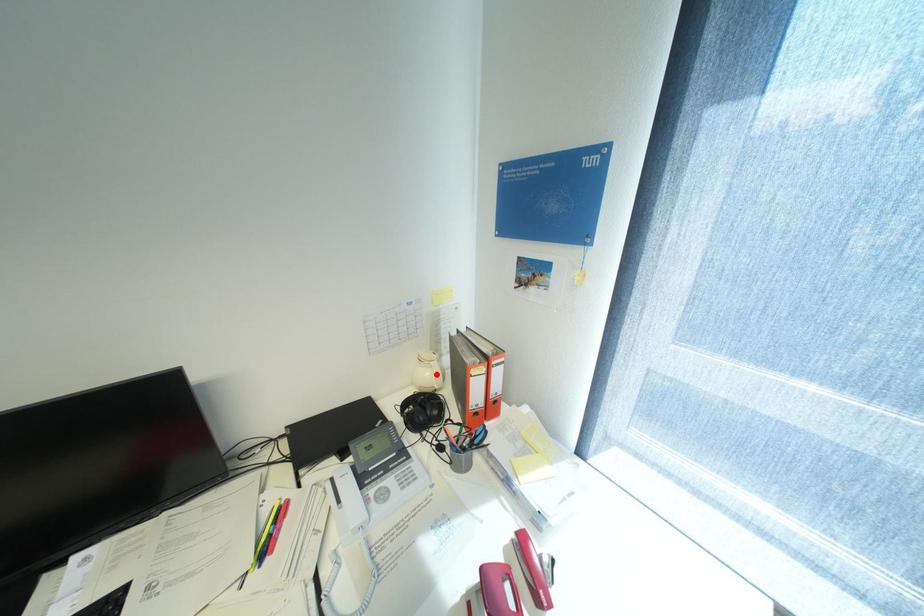
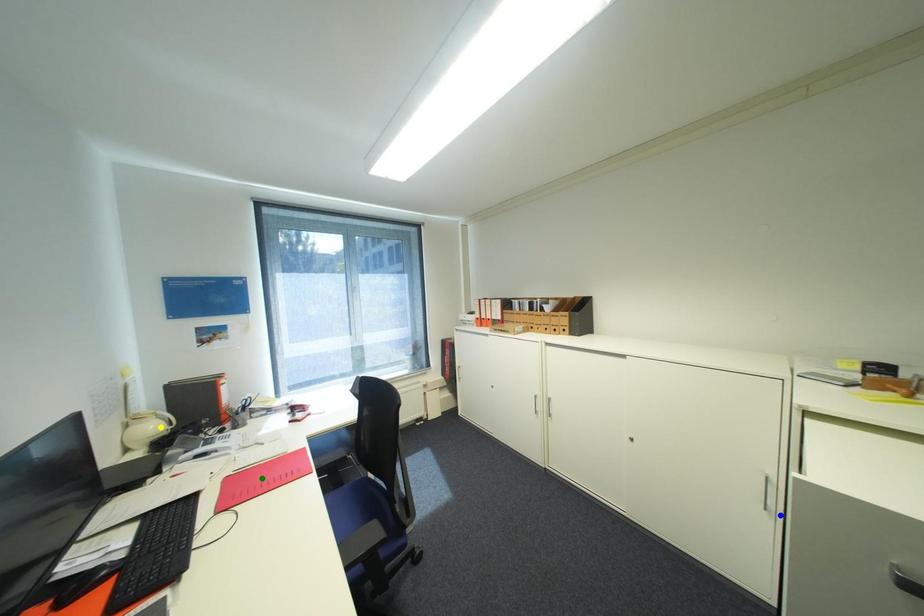
Question: I am providing you with two images of the same scene from different viewpoints. A red point is marked on the first image. You are given multiple points on the second image. Which mark in image 2 goes with the point in image 1?

Choices:
 (A) blue point
 (B) green point
 (C) yellow point

Answer: (C)